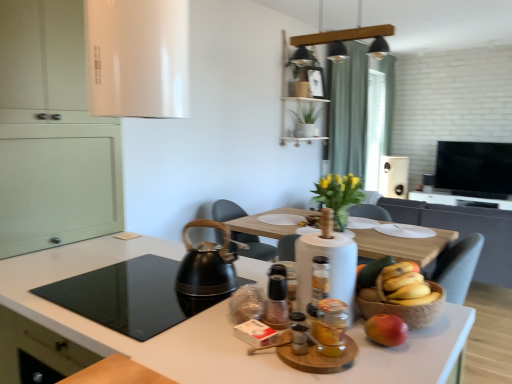
In order to click on vacant area on top of black glass cooktop at lower left (from a real-world perspective) in this screenshot , I will do `click(136, 288)`.